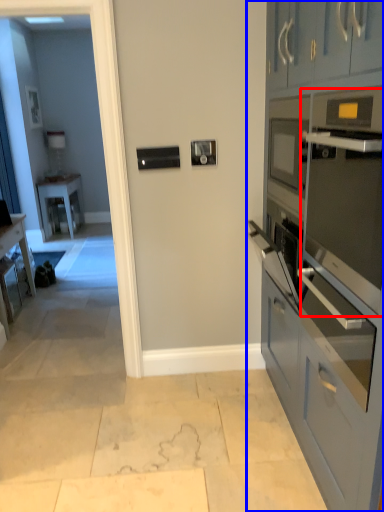
Question: Which of the following is the closest to the observer, oven (highlighted by a red box) or cabinetry (highlighted by a blue box)?

Choices:
 (A) oven
 (B) cabinetry

Answer: (B)